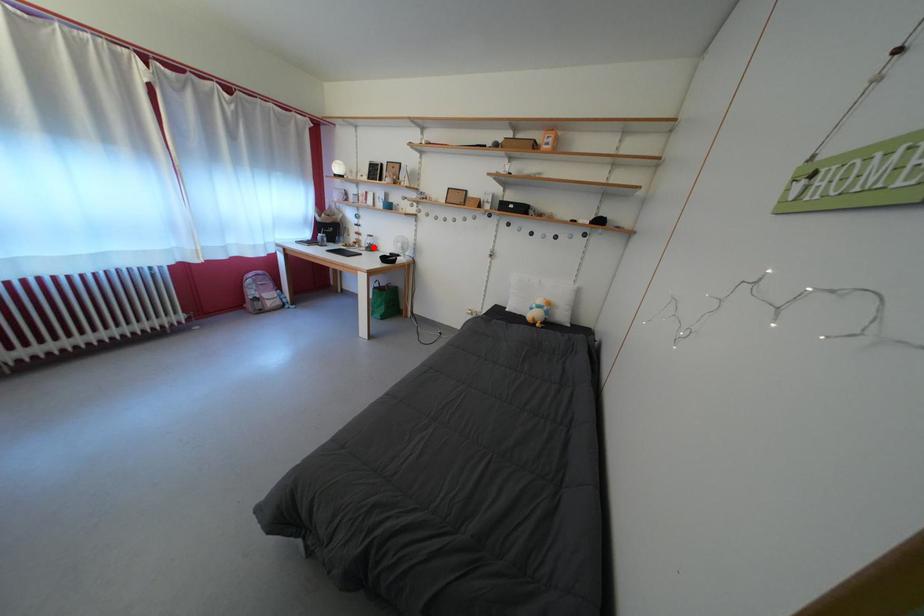
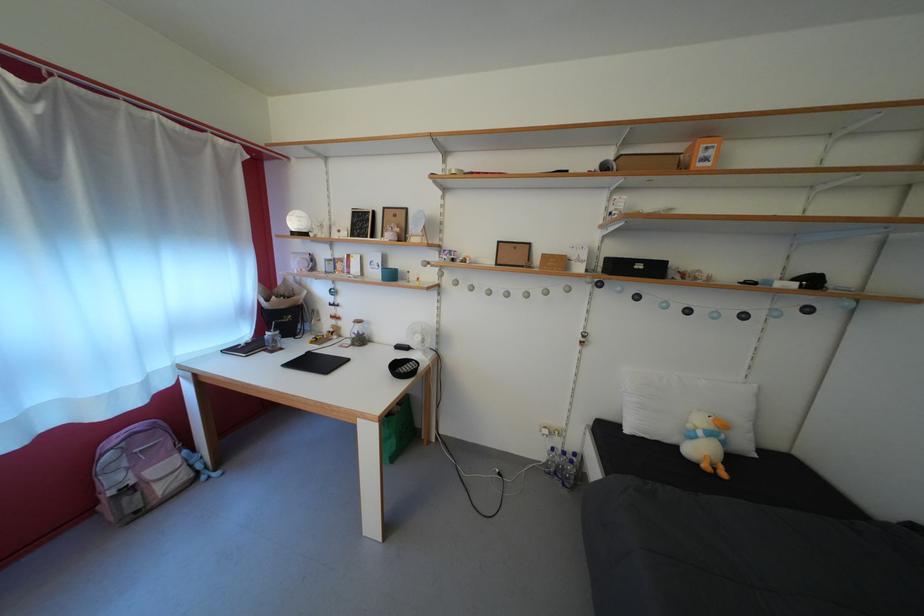
Question: I am providing you with two images of the same scene from different viewpoints. In image1, a red point is highlighted. Considering the same 3D point in image2, which of the following is correct?

Choices:
 (A) It is closer
 (B) It is farther

Answer: (B)